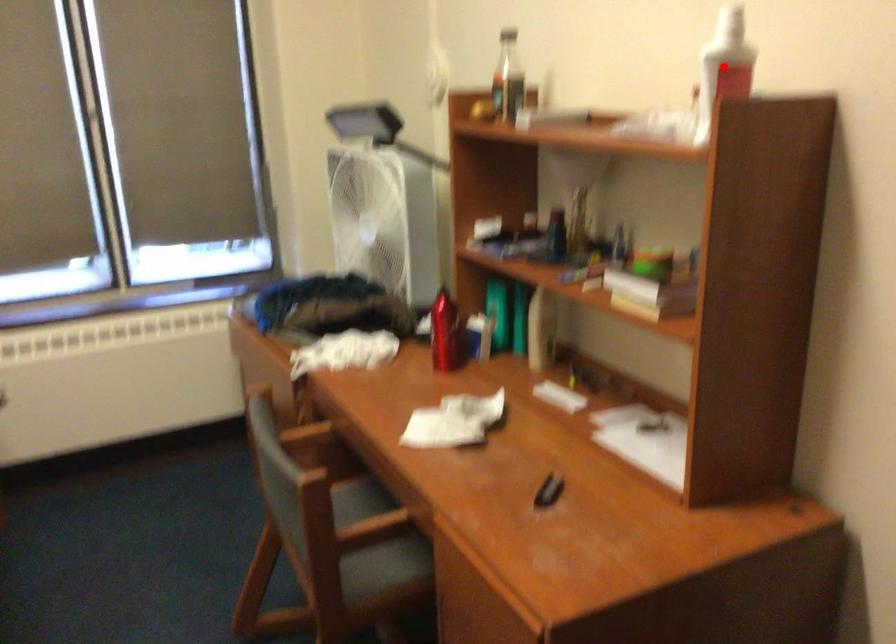
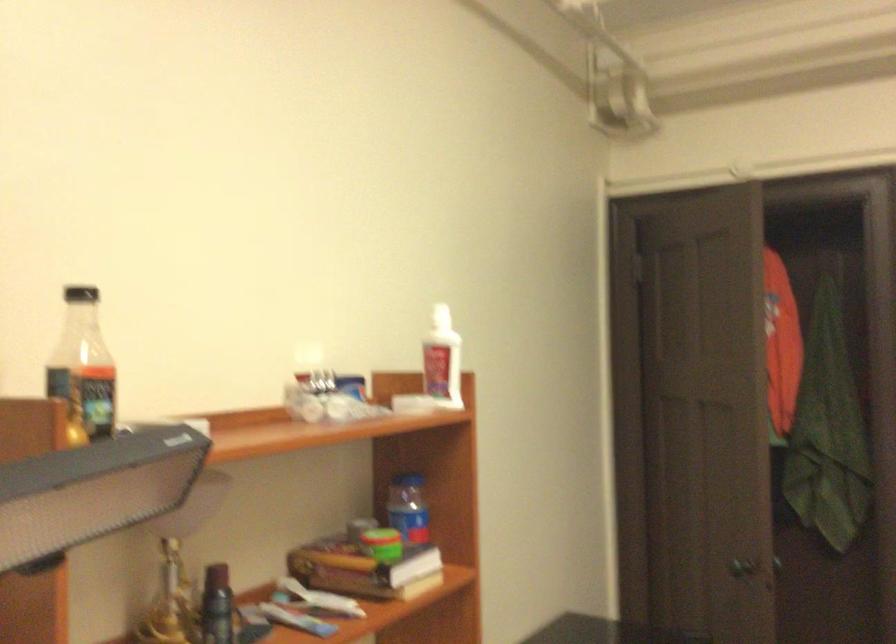
Question: I am providing you with two images of the same scene from different viewpoints. A red point is marked on the first image. Can you still see the location of the red point in image 2?

Choices:
 (A) Yes
 (B) No

Answer: (B)